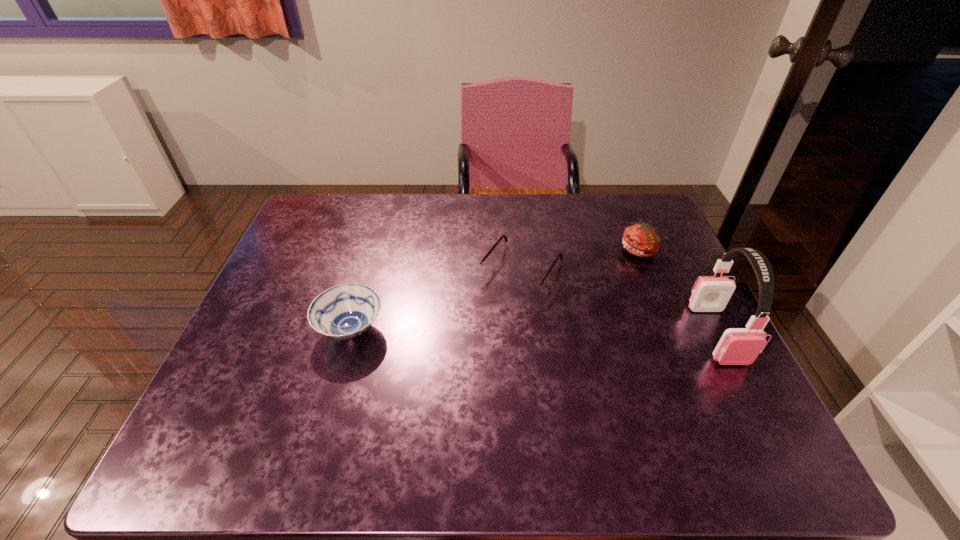
Locate an element on the screen. vacant space situated on the front-facing side of the second tallest object is located at coordinates (563, 335).

Identify the location of vacant space located at the hinge ends of the shortest object. (435, 393).

Where is `vacant space located at the hinge ends of the shortest object`? vacant space located at the hinge ends of the shortest object is located at coordinates (478, 331).

Locate an element on the screen. The height and width of the screenshot is (540, 960). vacant area situated 0.280m at the hinge ends of the shortest object is located at coordinates (445, 379).

You are a GUI agent. You are given a task and a screenshot of the screen. Output one action in this format:
    pyautogui.click(x=<x>, y=<y>)
    Task: Click on the object at the far edge
    This screenshot has height=540, width=960.
    Given the screenshot: What is the action you would take?
    pyautogui.click(x=641, y=239)

Identify the location of earphone that is at the right edge. (738, 346).

The height and width of the screenshot is (540, 960). Identify the location of tomato that is at the right edge. (641, 239).

The image size is (960, 540). In order to click on object located in the far right corner section of the desktop in this screenshot , I will do `click(641, 239)`.

In order to click on vacant space at the far edge of the desktop in this screenshot , I will do `click(497, 212)`.

Identify the location of vacant space at the near edge. The width and height of the screenshot is (960, 540). (349, 408).